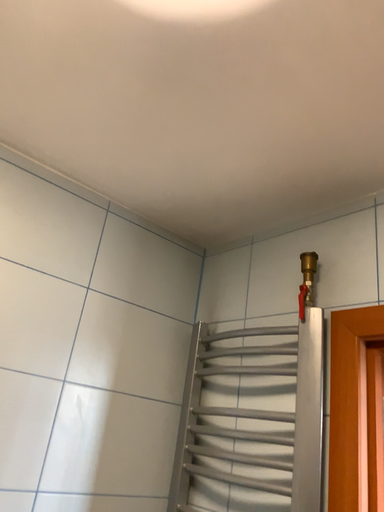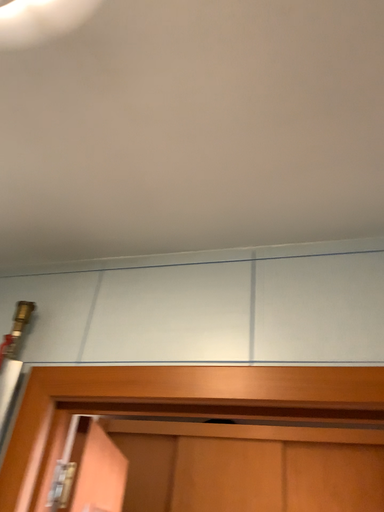
Question: Which way did the camera rotate in the video?

Choices:
 (A) rotated left
 (B) rotated right

Answer: (B)